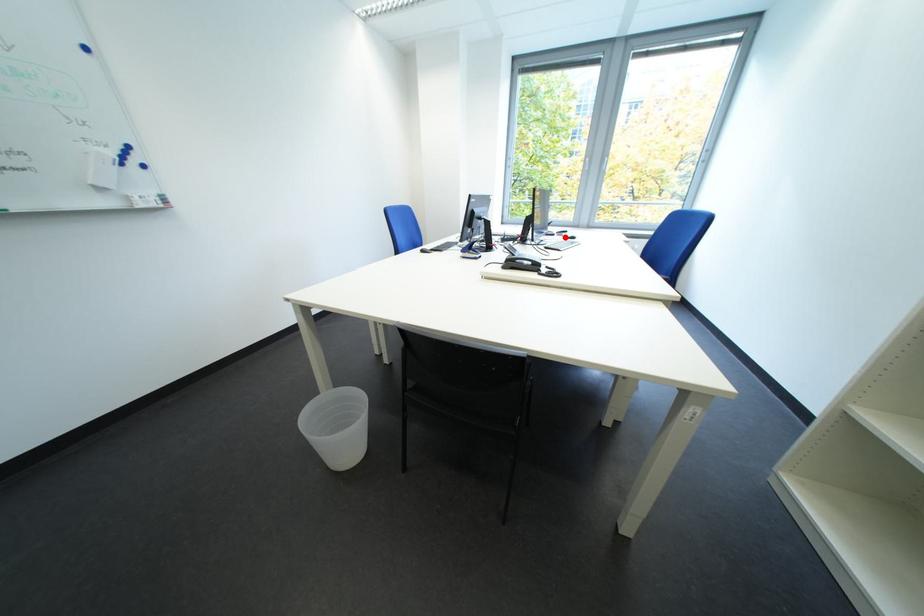
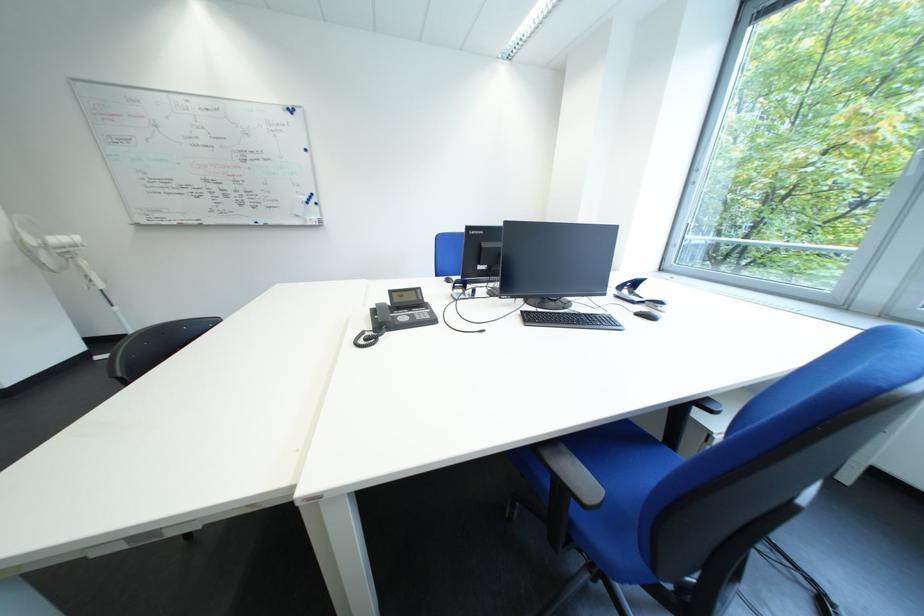
Locate, in the second image, the point that corresponds to the highlighted location in the first image.

(645, 305)